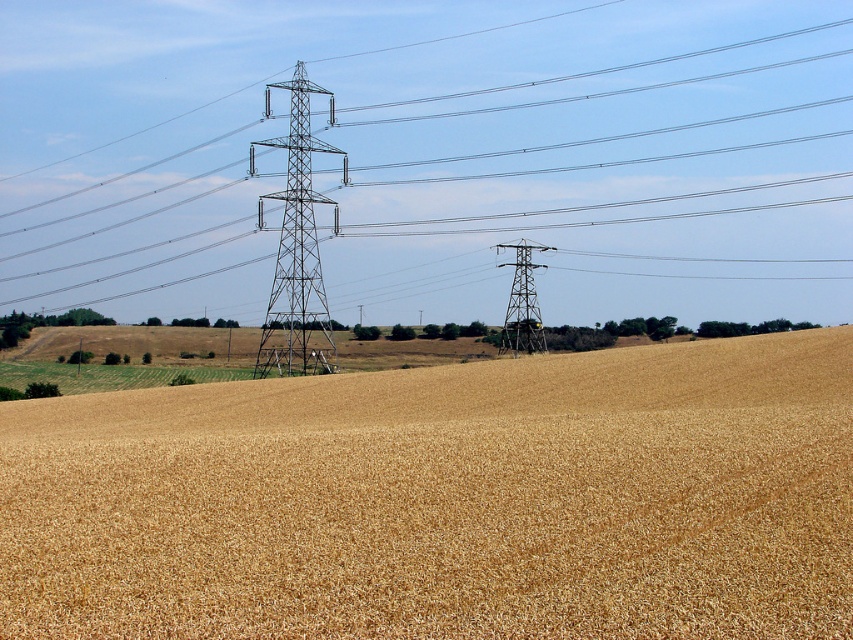
Question: Can you confirm if metallic silver power line at upper center is bigger than golden matte wheat field at center?

Choices:
 (A) no
 (B) yes

Answer: (B)

Question: Is metallic silver tower at center smaller than metallic gray tower at center?

Choices:
 (A) yes
 (B) no

Answer: (B)

Question: Which point is farther from the camera taking this photo?

Choices:
 (A) (422, 468)
 (B) (518, 310)

Answer: (B)

Question: Which point is closer to the camera?

Choices:
 (A) golden matte wheat field at center
 (B) metallic gray tower at center
 (C) metallic silver power line at upper center
 (D) metallic silver tower at center

Answer: (A)

Question: Which point is farther to the camera?

Choices:
 (A) [311, 86]
 (B) [529, 349]

Answer: (B)

Question: Is metallic silver power line at upper center smaller than golden matte wheat field at center?

Choices:
 (A) yes
 (B) no

Answer: (B)